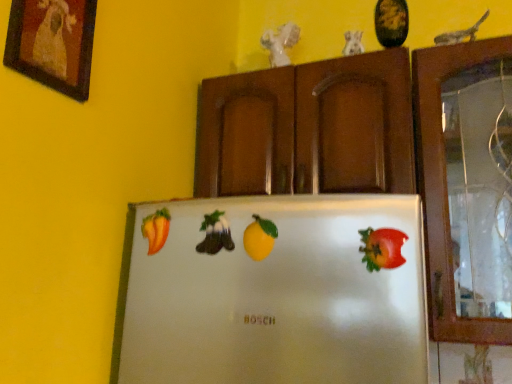
Question: From the image's perspective, is yellow matte lemon at center, which is the third fruit from left to right, located beneath shiny red apple at right, which ranks as the fourth fruit in back-to-front order?

Choices:
 (A) yes
 (B) no

Answer: (B)

Question: Is yellow matte lemon at center, which is counted as the 2th fruit, starting from the right, wider than shiny red apple at right, arranged as the first fruit when viewed from the front?

Choices:
 (A) yes
 (B) no

Answer: (A)

Question: Is yellow matte lemon at center, which is counted as the 2th fruit, starting from the right, not within shiny red apple at right, acting as the first fruit starting from the right?

Choices:
 (A) no
 (B) yes

Answer: (B)

Question: Can you confirm if yellow matte lemon at center, which is the third fruit from left to right, is taller than shiny red apple at right, arranged as the first fruit when viewed from the front?

Choices:
 (A) yes
 (B) no

Answer: (A)

Question: Could shiny red apple at right, acting as the first fruit starting from the right, be considered to be inside yellow matte lemon at center, which is the third fruit from left to right?

Choices:
 (A) no
 (B) yes

Answer: (A)

Question: From the image's perspective, would you say yellow matte lemon at center, which is counted as the 2th fruit, starting from the right, is positioned over shiny red apple at right, acting as the first fruit starting from the right?

Choices:
 (A) yes
 (B) no

Answer: (A)

Question: Does smooth orange pepper at left, which is counted as the 4th fruit, starting from the front, have a smaller size compared to yellow matte lemon at center, which is the third fruit from left to right?

Choices:
 (A) yes
 (B) no

Answer: (B)

Question: Is smooth orange pepper at left, which is counted as the 4th fruit, starting from the front, positioned far away from yellow matte lemon at center, which is the third fruit from left to right?

Choices:
 (A) no
 (B) yes

Answer: (A)

Question: Is smooth orange pepper at left, the 4th fruit positioned from the right, turned away from yellow matte lemon at center, which is counted as the 2th fruit, starting from the right?

Choices:
 (A) yes
 (B) no

Answer: (B)

Question: From the image's perspective, is smooth orange pepper at left, the 1th fruit viewed from the back, located above yellow matte lemon at center, the 3th fruit viewed from the back?

Choices:
 (A) no
 (B) yes

Answer: (B)

Question: Is smooth orange pepper at left, which is counted as the 4th fruit, starting from the front, to the left of yellow matte lemon at center, which is counted as the 2th fruit, starting from the right, from the viewer's perspective?

Choices:
 (A) no
 (B) yes

Answer: (B)

Question: Is smooth orange pepper at left, the 1th fruit viewed from the back, shorter than yellow matte lemon at center, the 3th fruit viewed from the back?

Choices:
 (A) no
 (B) yes

Answer: (A)

Question: Is smooth orange pepper at left, the 4th fruit positioned from the right, surrounded by green matte bell pepper at center, the third fruit viewed from the front?

Choices:
 (A) no
 (B) yes

Answer: (A)